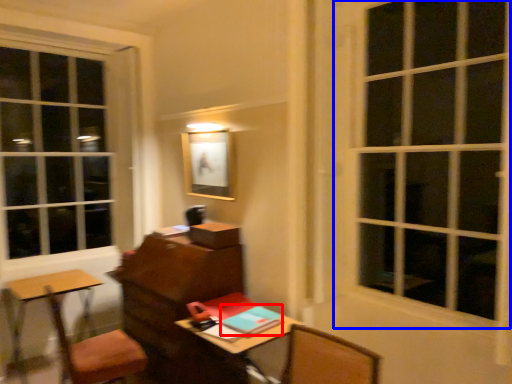
Question: Which object appears closest to the camera in this image, notebook (highlighted by a red box) or window (highlighted by a blue box)?

Choices:
 (A) notebook
 (B) window

Answer: (B)